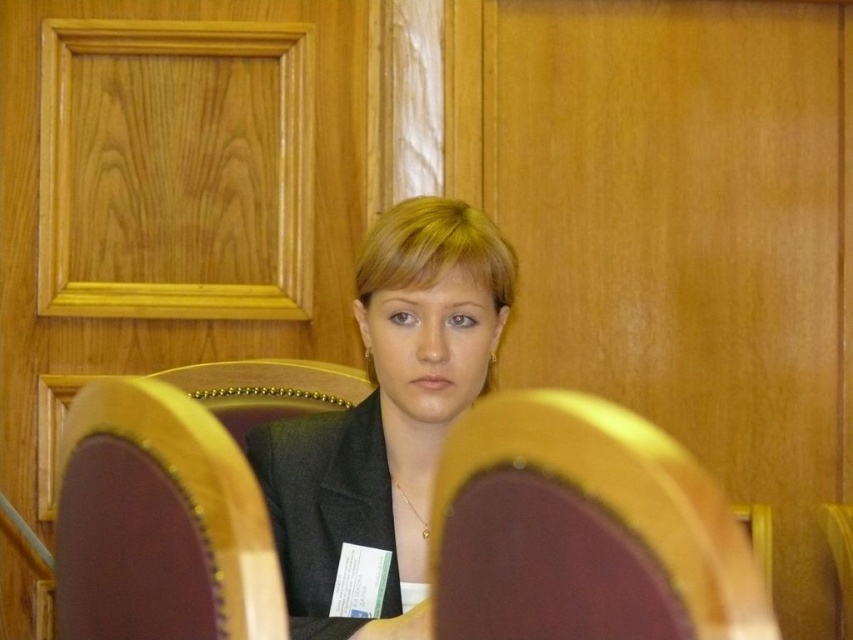
Measure the distance from maroon fabric chair at center to wooden polished chair at center.

maroon fabric chair at center and wooden polished chair at center are 9.82 inches apart from each other.

Is maroon fabric chair at center further to the viewer compared to wooden polished chair at center?

No, it is in front of wooden polished chair at center.

Which is in front, point (471, 518) or point (171, 608)?

Point (471, 518)

Where is `maroon fabric chair at center`? The height and width of the screenshot is (640, 853). maroon fabric chair at center is located at coordinates (584, 531).

From the picture: Who is shorter, matte black suit at center or wooden polished chair at center?

wooden polished chair at center

From the picture: Can you confirm if matte black suit at center is bigger than wooden polished chair at center?

Yes.

Where is `matte black suit at center`? The height and width of the screenshot is (640, 853). matte black suit at center is located at coordinates (387, 416).

Where is `matte black suit at center`? matte black suit at center is located at coordinates (387, 416).

Which is below, maroon fabric chair at center or matte black suit at center?

maroon fabric chair at center

Based on the photo, between maroon fabric chair at center and matte black suit at center, which one has less height?

maroon fabric chair at center

Does point (698, 609) come farther from viewer compared to point (402, 634)?

That is False.

Locate an element on the screen. Image resolution: width=853 pixels, height=640 pixels. maroon fabric chair at center is located at coordinates (584, 531).